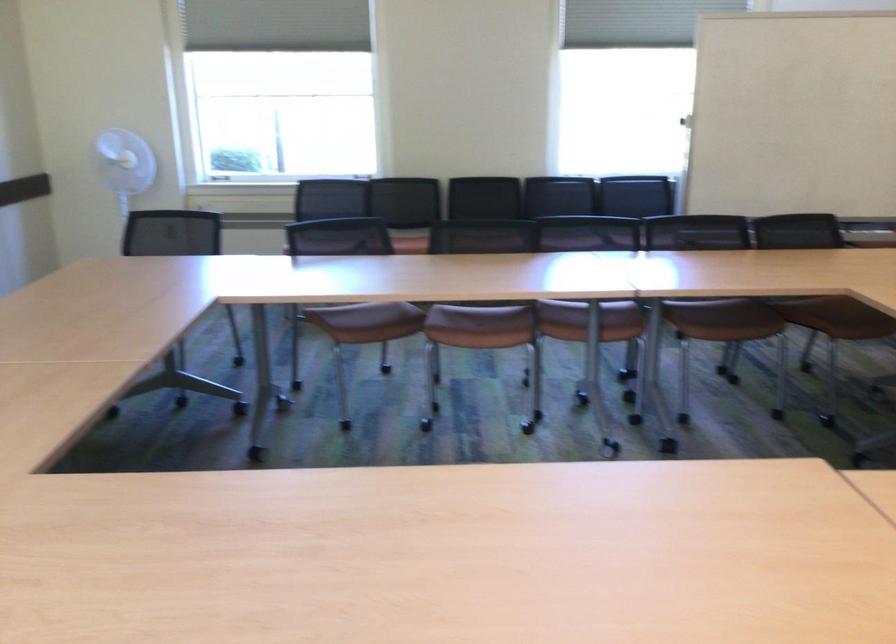
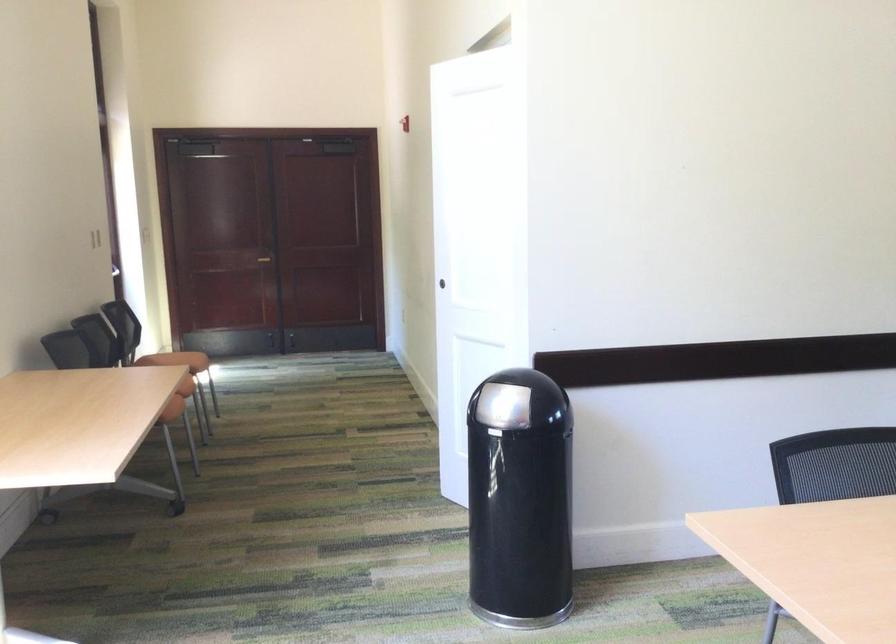
Question: The first image is from the beginning of the video and the second image is from the end. How did the camera likely rotate when shooting the video?

Choices:
 (A) Left
 (B) Right
 (C) Up
 (D) Down

Answer: (A)